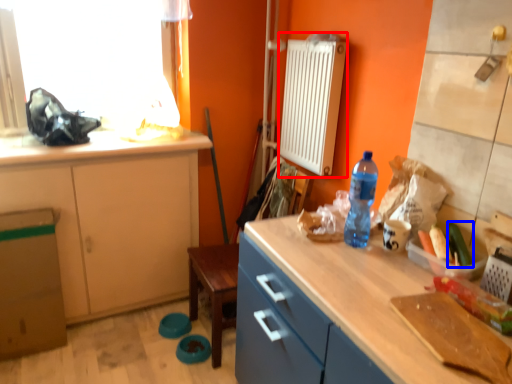
Question: Which object is further to the camera taking this photo, radiator (highlighted by a red box) or vegetable (highlighted by a blue box)?

Choices:
 (A) radiator
 (B) vegetable

Answer: (A)